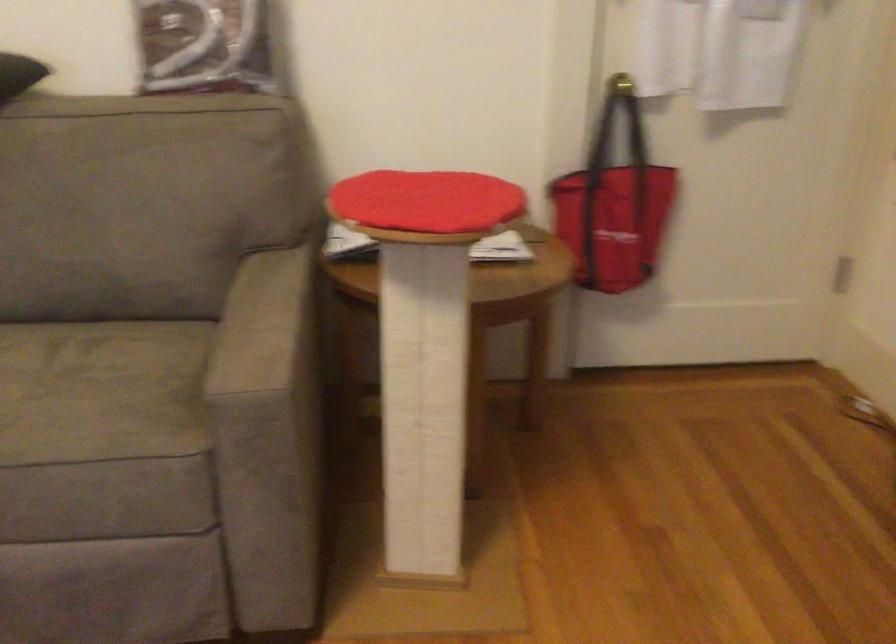
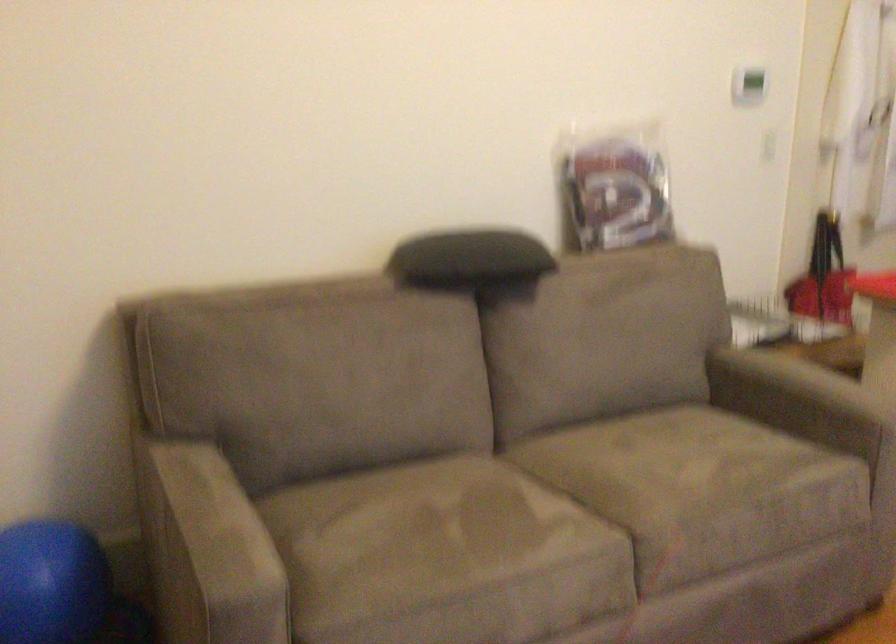
Where in the second image is the point corresponding to pixel 250 341 from the first image?

(798, 400)